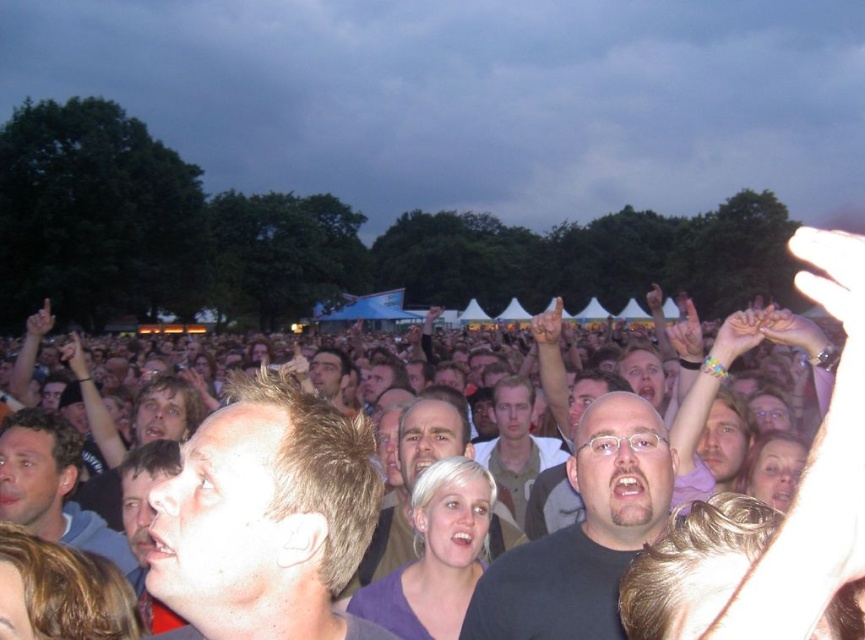
Question: Which point is closer to the camera?

Choices:
 (A) light brown leather jacket at center
 (B) black matte shirt at center
 (C) light brown hair at center
 (D) smooth brown hair at center

Answer: (C)

Question: Where is smooth brown hair at center located in relation to light brown leather jacket at center in the image?

Choices:
 (A) below
 (B) above

Answer: (B)

Question: Is smooth brown hair at center bigger than light brown leather jacket at center?

Choices:
 (A) yes
 (B) no

Answer: (A)

Question: Does light brown hair at lower left appear over smooth brown hair at center?

Choices:
 (A) no
 (B) yes

Answer: (A)

Question: Which object is closer to the camera taking this photo?

Choices:
 (A) light brown hair at center
 (B) smooth brown hair at center
 (C) black matte shirt at center

Answer: (A)

Question: Which of the following is the farthest from the observer?

Choices:
 (A) black matte shirt at center
 (B) light brown hair at lower left
 (C) light brown leather jacket at center
 (D) light brown hair at center

Answer: (C)